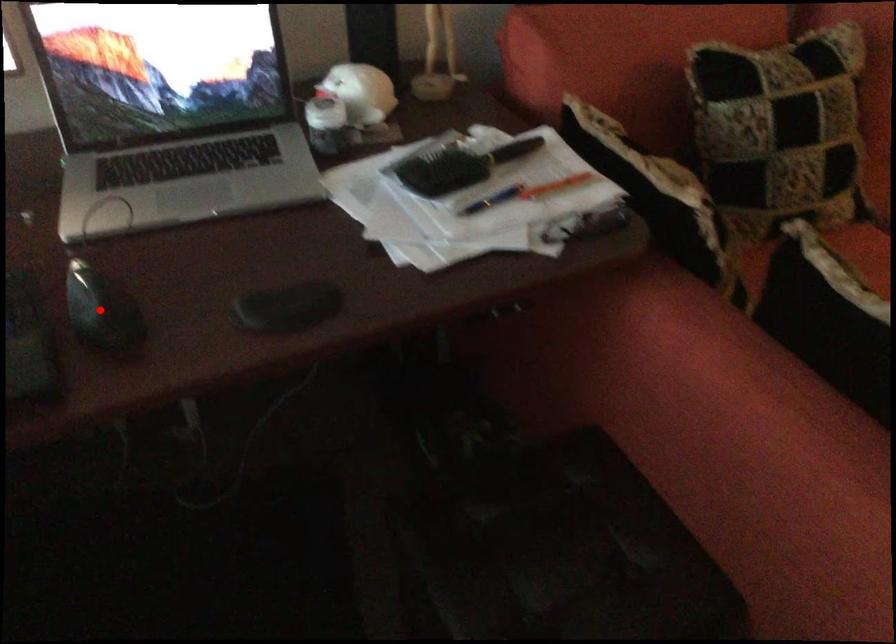
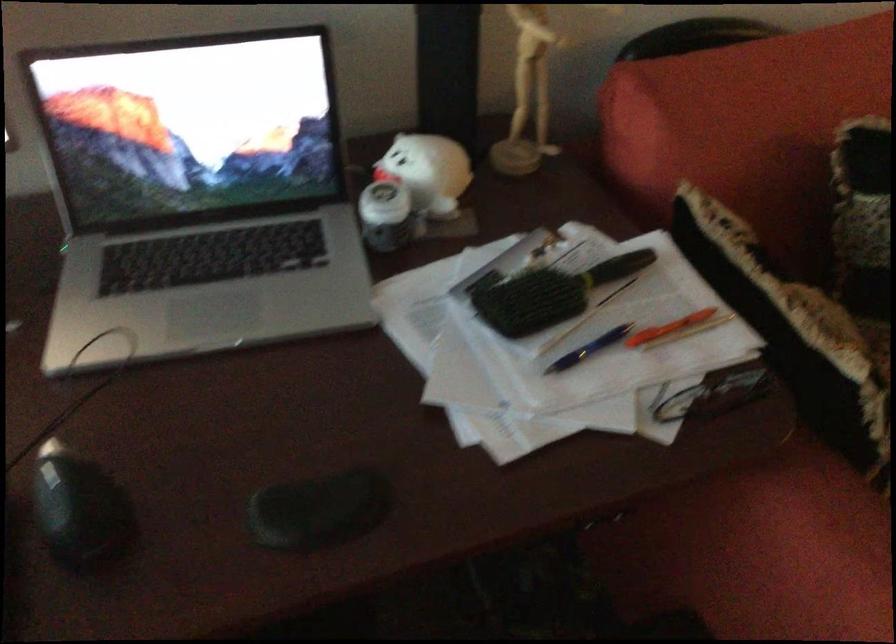
Question: I am providing you with two images of the same scene from different viewpoints. A red point is shown in image1. For the corresponding object point in image2, is it positioned nearer or farther from the camera?

Choices:
 (A) Nearer
 (B) Farther

Answer: (A)